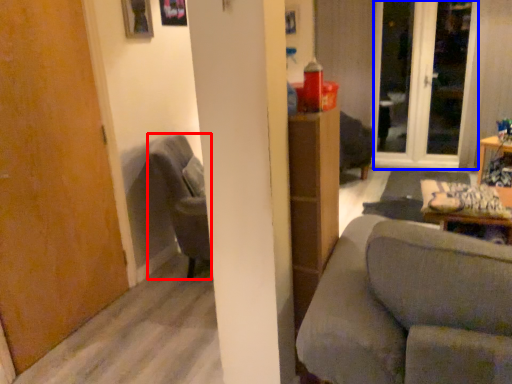
Question: Among these objects, which one is nearest to the camera, chair (highlighted by a red box) or screen door (highlighted by a blue box)?

Choices:
 (A) chair
 (B) screen door

Answer: (A)